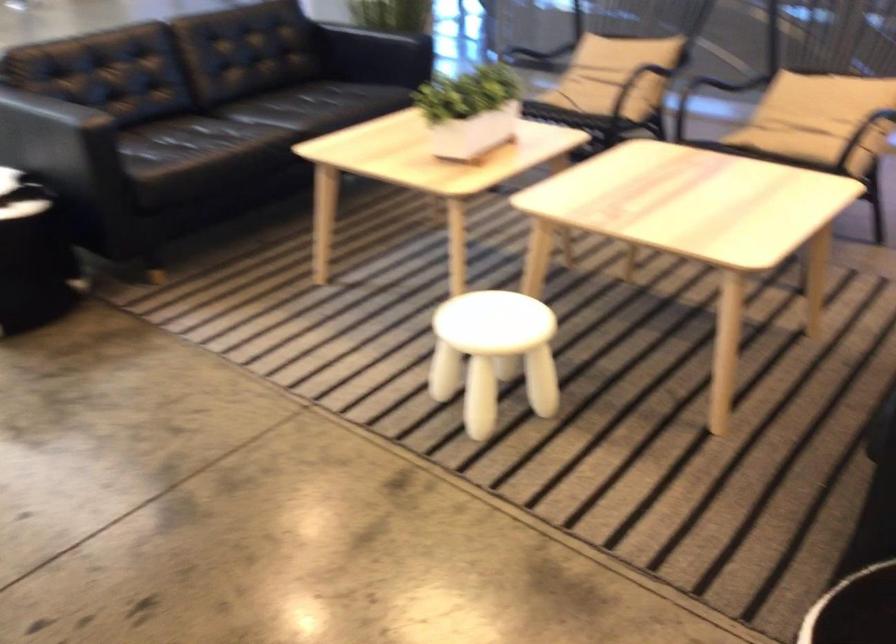
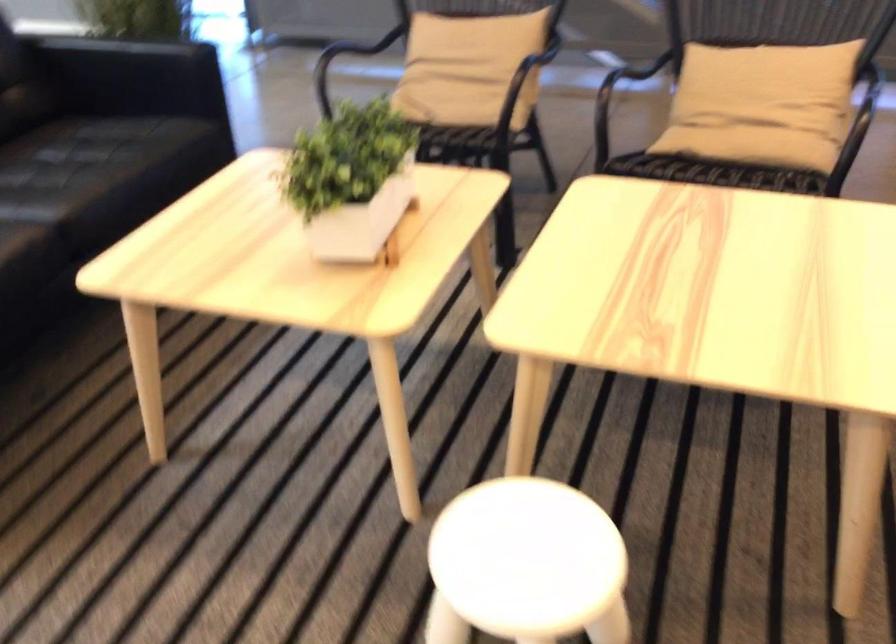
Question: In a continuous first-person perspective shot, in which direction is the camera moving?

Choices:
 (A) Left
 (B) Right
 (C) Forward
 (D) Backward

Answer: (C)